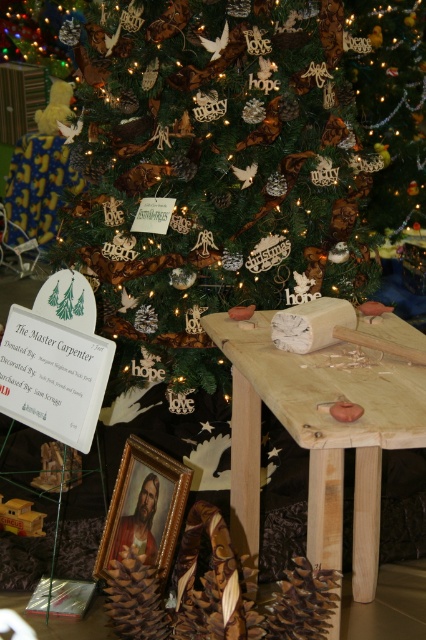
Question: Which point is closer to the camera taking this photo?

Choices:
 (A) (137, 552)
 (B) (377, 564)
 (C) (282, 29)

Answer: (A)

Question: Does natural wood table at center have a larger size compared to brown matte pine cone at lower center?

Choices:
 (A) no
 (B) yes

Answer: (B)

Question: Is natural wood table at center wider than brown matte pine cone at lower center?

Choices:
 (A) no
 (B) yes

Answer: (B)

Question: Considering the real-world distances, which object is farthest from the natural wood table at center?

Choices:
 (A) green textured christmas tree at center
 (B) brown matte pine cone at lower center

Answer: (A)

Question: Is natural wood table at center closer to camera compared to brown matte pine cone at lower center?

Choices:
 (A) no
 (B) yes

Answer: (A)

Question: Estimate the real-world distances between objects in this image. Which object is closer to the green textured christmas tree at center?

Choices:
 (A) brown matte pine cone at lower center
 (B) natural wood table at center

Answer: (B)